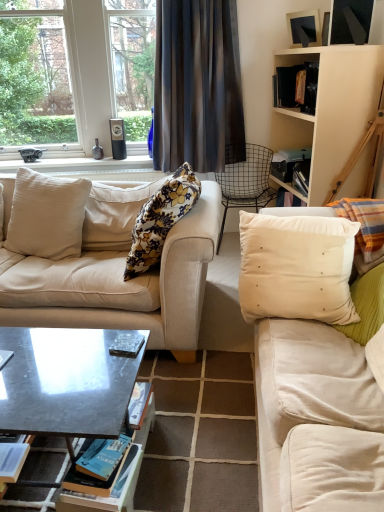
Question: Is dark gray sheer curtain at upper center thinner than clear glass window at upper left?

Choices:
 (A) yes
 (B) no

Answer: (A)

Question: Is dark gray sheer curtain at upper center aimed at clear glass window at upper left?

Choices:
 (A) no
 (B) yes

Answer: (A)

Question: Can you confirm if dark gray sheer curtain at upper center is bigger than clear glass window at upper left?

Choices:
 (A) no
 (B) yes

Answer: (A)

Question: Can you confirm if dark gray sheer curtain at upper center is positioned to the right of clear glass window at upper left?

Choices:
 (A) yes
 (B) no

Answer: (A)

Question: Does dark gray sheer curtain at upper center have a lesser height compared to clear glass window at upper left?

Choices:
 (A) yes
 (B) no

Answer: (A)

Question: Is dark gray sheer curtain at upper center to the left of clear glass window at upper left from the viewer's perspective?

Choices:
 (A) yes
 (B) no

Answer: (B)

Question: Could you tell me if white satin pillow at right, the fourth pillow when ordered from left to right, is turned towards metallic gray book at center, placed as the 2th book when sorted from top to bottom?

Choices:
 (A) no
 (B) yes

Answer: (A)

Question: Is white satin pillow at right, the fourth pillow when ordered from left to right, turned away from metallic gray book at center, placed as the 2th book when sorted from top to bottom?

Choices:
 (A) no
 (B) yes

Answer: (A)

Question: Is white satin pillow at right, the fourth pillow when ordered from left to right, smaller than metallic gray book at center, acting as the first book starting from the left?

Choices:
 (A) yes
 (B) no

Answer: (B)

Question: From the image's perspective, does white satin pillow at right, the fourth pillow when ordered from left to right, appear lower than metallic gray book at center, the 3th book when ordered from right to left?

Choices:
 (A) yes
 (B) no

Answer: (B)

Question: Considering the relative positions of white satin pillow at right, the 1th pillow positioned from the right, and metallic gray book at center, marked as the 2th book in a bottom-to-top arrangement, in the image provided, is white satin pillow at right, the 1th pillow positioned from the right, behind metallic gray book at center, marked as the 2th book in a bottom-to-top arrangement,?

Choices:
 (A) yes
 (B) no

Answer: (A)

Question: Can you confirm if white satin pillow at right, the fourth pillow when ordered from left to right, is positioned to the right of metallic gray book at center, acting as the first book starting from the left?

Choices:
 (A) no
 (B) yes

Answer: (B)

Question: Is hardcover book at center, placed as the first book when sorted from bottom to top, positioned beyond the bounds of floral fabric pillow at center, which appears as the second pillow when viewed from the left?

Choices:
 (A) no
 (B) yes

Answer: (B)